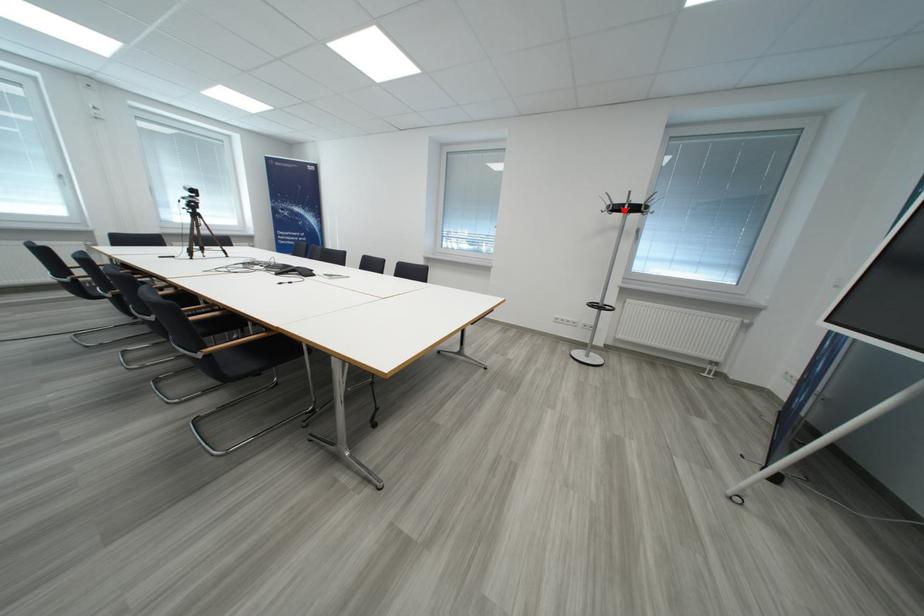
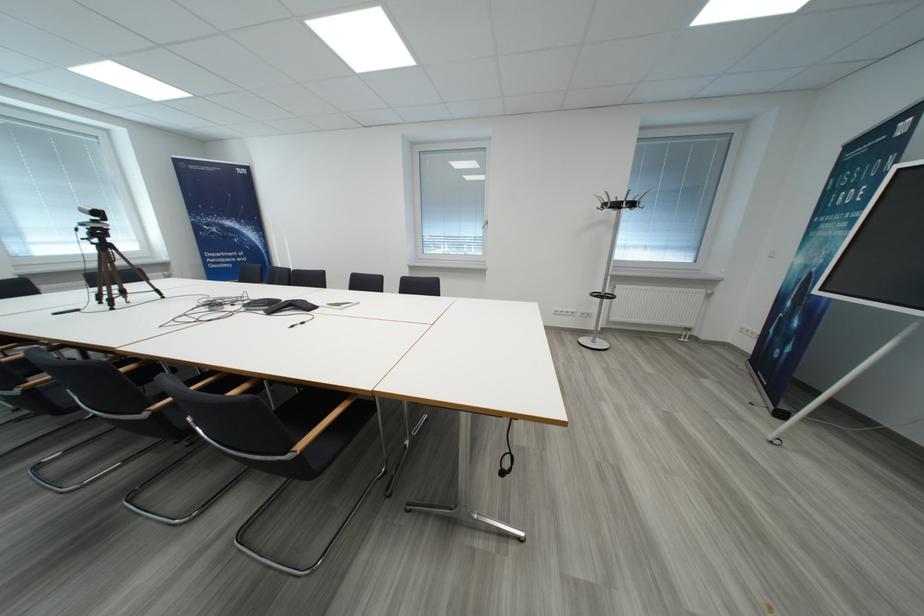
Question: A red point is marked in image1. In image2, is the corresponding 3D point closer to the camera or farther? Reply with the corresponding letter.

Choices:
 (A) The corresponding 3D point is closer.
 (B) The corresponding 3D point is farther.

Answer: (B)